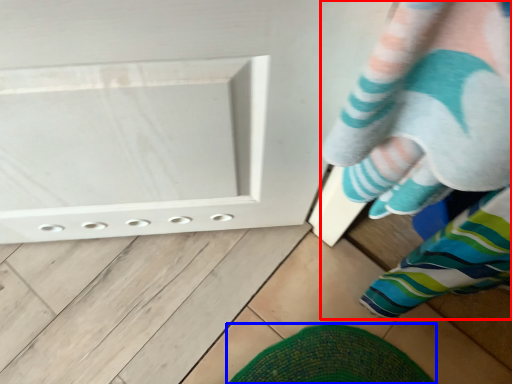
Question: Among these objects, which one is nearest to the camera, person (highlighted by a red box) or footwear (highlighted by a blue box)?

Choices:
 (A) person
 (B) footwear

Answer: (A)